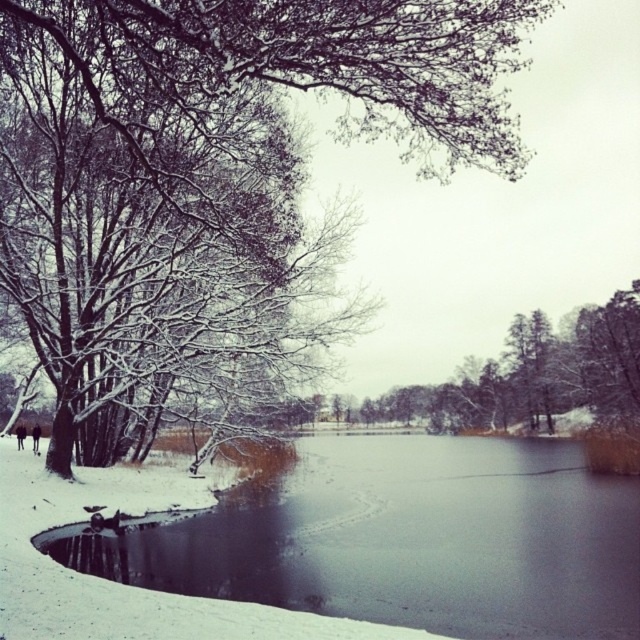
Who is taller, snow-covered branches at upper left or dark brown fur coat at lower left?

Standing taller between the two is snow-covered branches at upper left.

Does snow-covered branches at upper left lie in front of dark brown fur coat at lower left?

Yes, snow-covered branches at upper left is closer to the viewer.

The height and width of the screenshot is (640, 640). I want to click on snow-covered branches at upper left, so click(x=289, y=84).

Who is more forward, (484, 628) or (536, 349)?

Point (484, 628) is more forward.

In order to click on smooth ice lake at lower left in this screenshot , I will do `click(410, 540)`.

Does snow-covered branches at upper left have a greater height compared to green matte tree at center?

Yes.

Which is behind, point (234, 209) or point (548, 426)?

The point (548, 426) is behind.

Identify the location of snow-covered branches at upper left. The width and height of the screenshot is (640, 640). (289, 84).